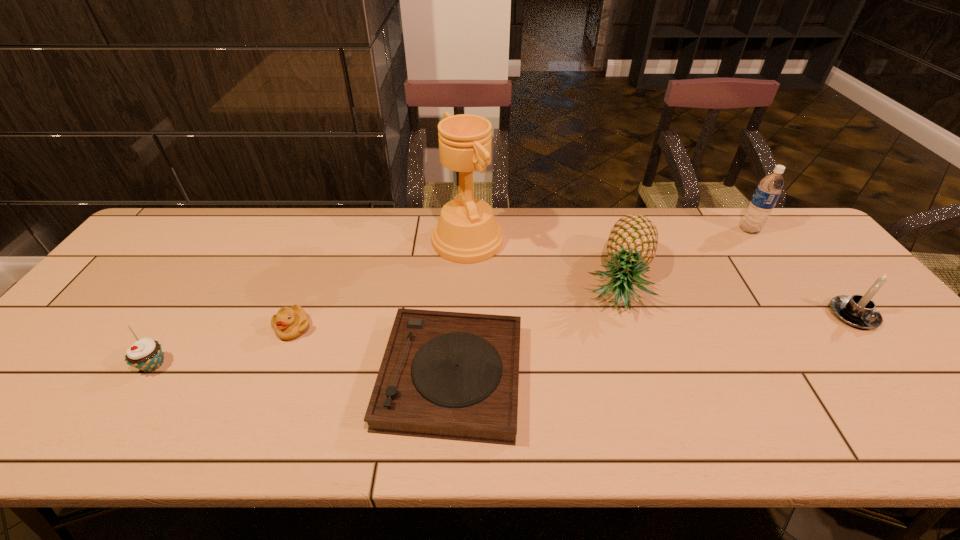
Identify the location of the tallest object. (467, 232).

The image size is (960, 540). Find the location of `the sixth shortest object`. the sixth shortest object is located at coordinates (768, 191).

Locate an element on the screen. The height and width of the screenshot is (540, 960). water bottle is located at coordinates (768, 191).

Locate an element on the screen. pineapple is located at coordinates (632, 243).

Identify the location of the rightmost object. The width and height of the screenshot is (960, 540). (859, 311).

Where is `cupcake`? cupcake is located at coordinates (145, 354).

The height and width of the screenshot is (540, 960). What are the coordinates of `the leftmost object` in the screenshot? It's located at (145, 354).

This screenshot has height=540, width=960. Find the location of `duckling`. duckling is located at coordinates (289, 323).

Identify the location of the second object from left to right. [x=289, y=323].

You are a GUI agent. You are given a task and a screenshot of the screen. Output one action in this format:
    pyautogui.click(x=<x>, y=<y>)
    Task: Click on the shortest object
    The image size is (960, 540).
    Given the screenshot: What is the action you would take?
    pyautogui.click(x=445, y=375)